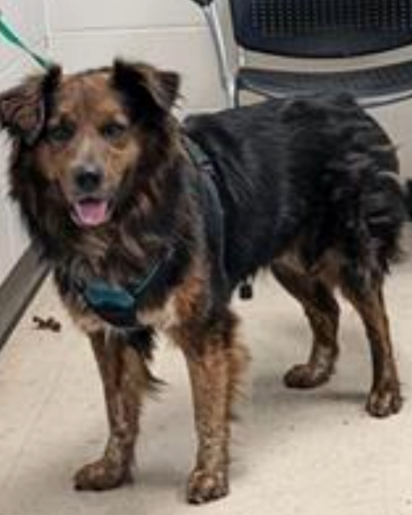
Locate an element on the screen. The width and height of the screenshot is (412, 515). floor is located at coordinates (260, 387).